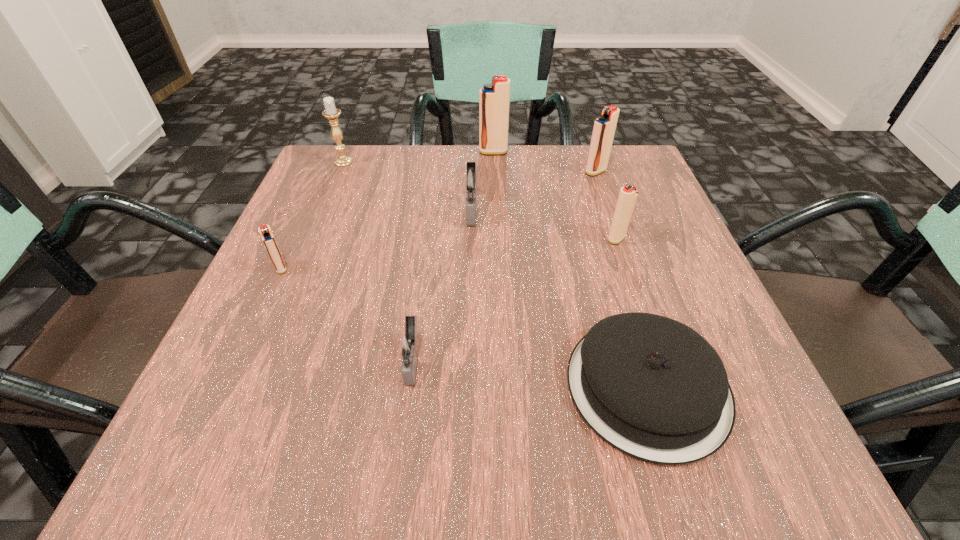
Identify the location of free location at the far edge. (431, 178).

The width and height of the screenshot is (960, 540). Find the location of `free space at the near edge of the desktop`. free space at the near edge of the desktop is located at coordinates (624, 475).

In the image, there is a desktop. Where is `vacant region at the left edge`? vacant region at the left edge is located at coordinates (317, 240).

Image resolution: width=960 pixels, height=540 pixels. I want to click on free spot at the right edge of the desktop, so click(646, 261).

Where is `vacant space at the far left corner`? The height and width of the screenshot is (540, 960). vacant space at the far left corner is located at coordinates (345, 198).

Locate an element on the screen. free space at the near left corner of the desktop is located at coordinates (296, 458).

In the image, there is a desktop. Where is `vacant space at the far right corner`? vacant space at the far right corner is located at coordinates (586, 166).

At what (x,y) coordinates should I click in order to perform the action: click on empty space that is in between the left gray igniter and the smallest red igniter. Please return your answer as a coordinate pair (x, y). The image size is (960, 540). Looking at the image, I should click on (347, 314).

Where is `blank region between the shortest object and the second farthest red igniter`? blank region between the shortest object and the second farthest red igniter is located at coordinates (621, 279).

The height and width of the screenshot is (540, 960). Find the location of `vacant space that is in between the farthest object and the smaller gray igniter`. vacant space that is in between the farthest object and the smaller gray igniter is located at coordinates (453, 256).